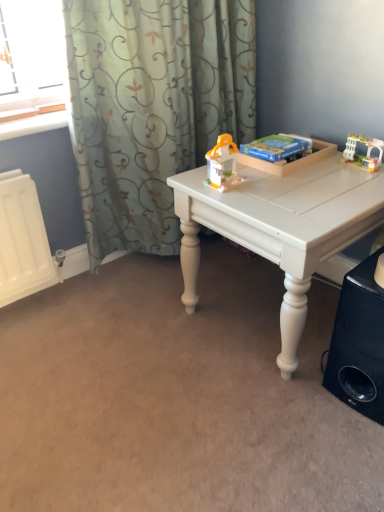
I want to click on vacant location below white matte table at center (from a real-world perspective), so click(260, 312).